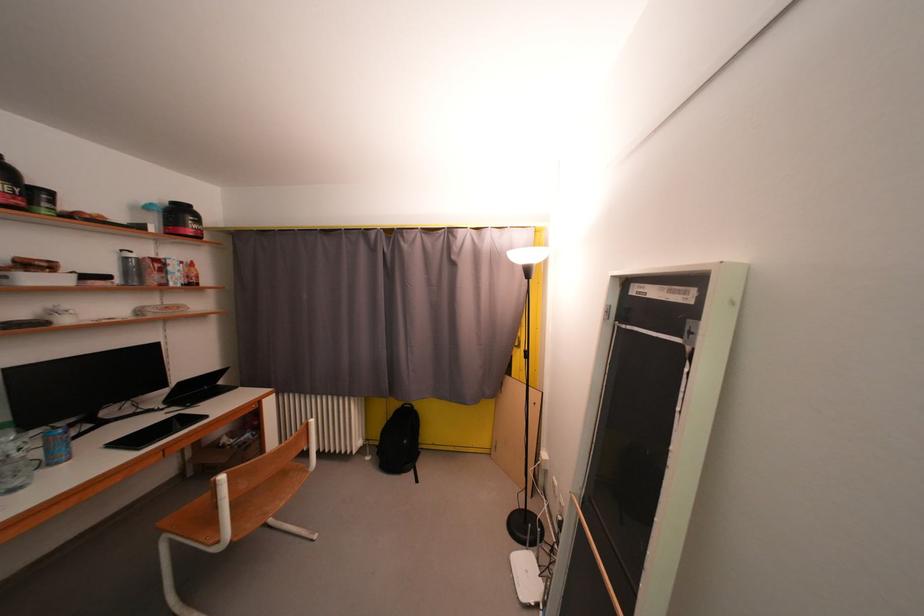
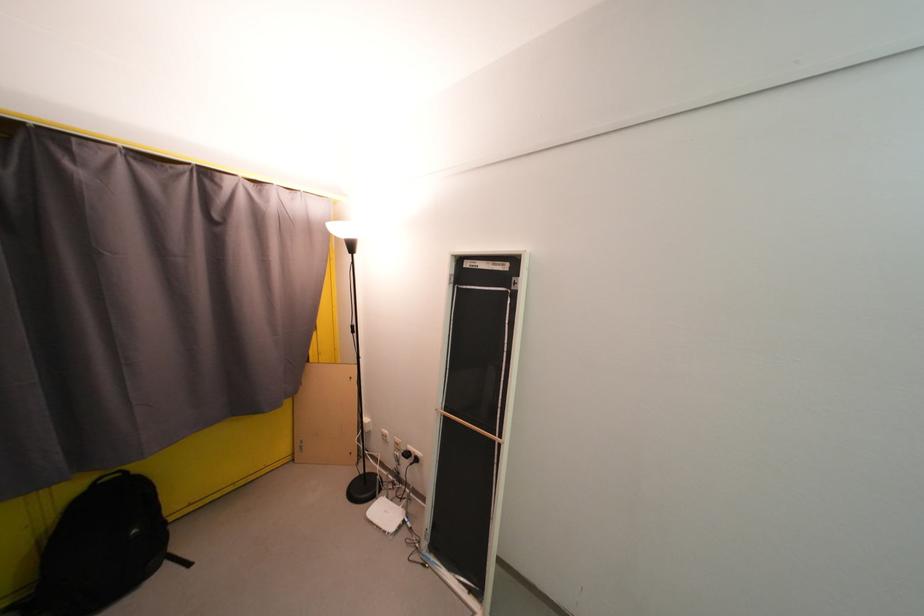
In the second image, find the point that corresponds to the point at 419,410 in the first image.

(134, 476)